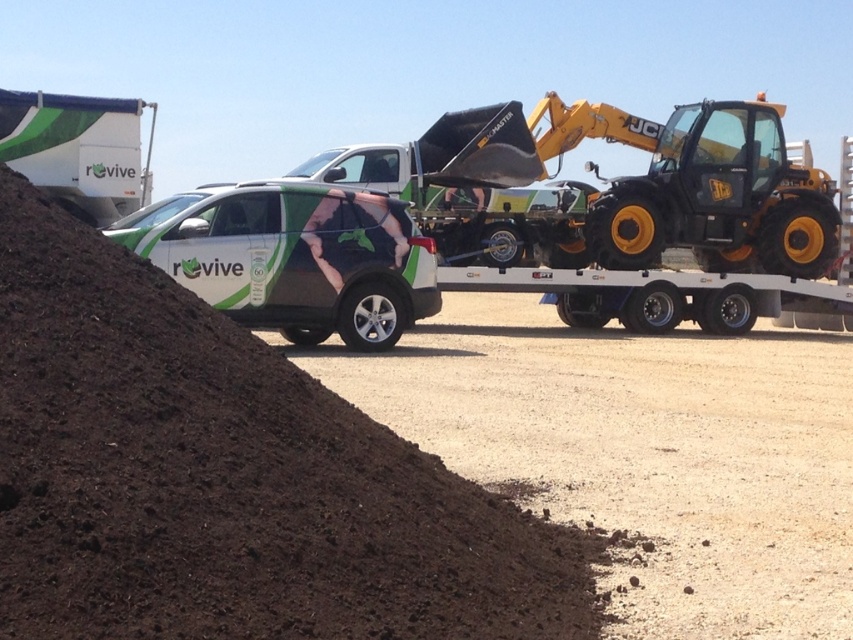
Question: Does dark brown soil at lower left appear over yellow metallic excavator at center?

Choices:
 (A) no
 (B) yes

Answer: (A)

Question: Can you confirm if dark brown soil at lower left is positioned below white glossy suv at center?

Choices:
 (A) no
 (B) yes

Answer: (B)

Question: Which is nearer to the dark brown soil at lower left?

Choices:
 (A) yellow metallic excavator at center
 (B) white glossy suv at center

Answer: (B)

Question: Is yellow metallic excavator at center to the left of white glossy suv at center from the viewer's perspective?

Choices:
 (A) no
 (B) yes

Answer: (A)

Question: Which point is closer to the camera?

Choices:
 (A) (349, 314)
 (B) (4, 413)
 (C) (671, 218)

Answer: (B)

Question: Considering the real-world distances, which object is closest to the yellow metallic excavator at center?

Choices:
 (A) white glossy suv at center
 (B) dark brown soil at lower left

Answer: (A)